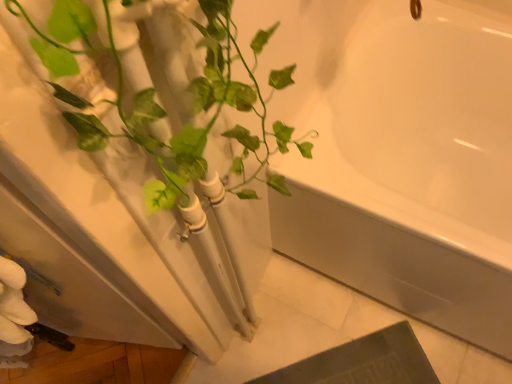
Question: Is white glossy bathtub at upper right bigger or smaller than green glossy plant at left?

Choices:
 (A) big
 (B) small

Answer: (A)

Question: Is white glossy bathtub at upper right to the left or to the right of green glossy plant at left in the image?

Choices:
 (A) left
 (B) right

Answer: (B)

Question: Is white glossy bathtub at upper right inside or outside of green glossy plant at left?

Choices:
 (A) outside
 (B) inside

Answer: (A)

Question: Considering the positions of green glossy plant at left and white glossy bathtub at upper right in the image, is green glossy plant at left taller or shorter than white glossy bathtub at upper right?

Choices:
 (A) tall
 (B) short

Answer: (A)

Question: Which is correct: green glossy plant at left is inside white glossy bathtub at upper right, or outside of it?

Choices:
 (A) inside
 (B) outside

Answer: (B)

Question: Looking at their shapes, would you say green glossy plant at left is wider or thinner than white glossy bathtub at upper right?

Choices:
 (A) thin
 (B) wide

Answer: (A)

Question: Considering their positions, is green glossy plant at left located in front of or behind white glossy bathtub at upper right?

Choices:
 (A) behind
 (B) front

Answer: (B)